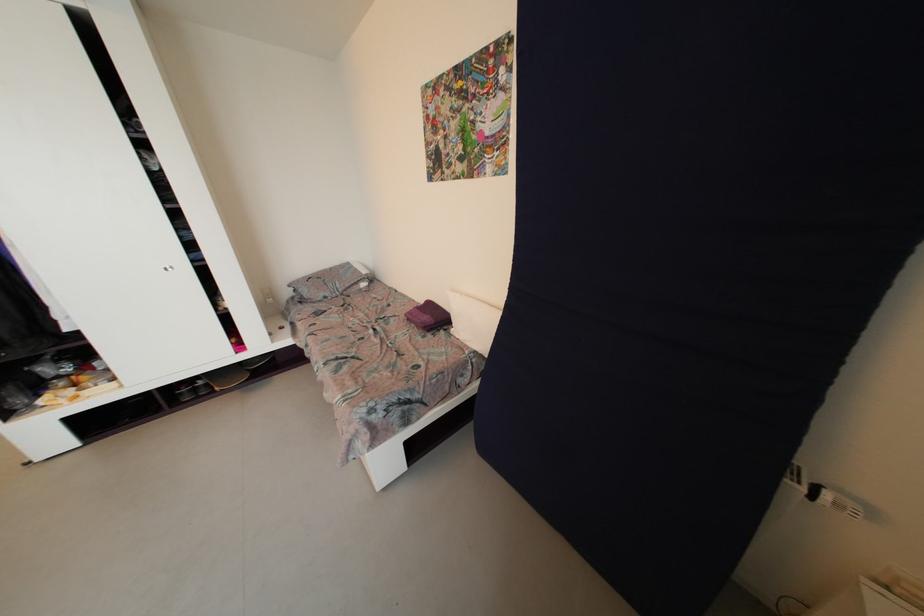
Where is `patterned pillow`? This screenshot has width=924, height=616. patterned pillow is located at coordinates (329, 282).